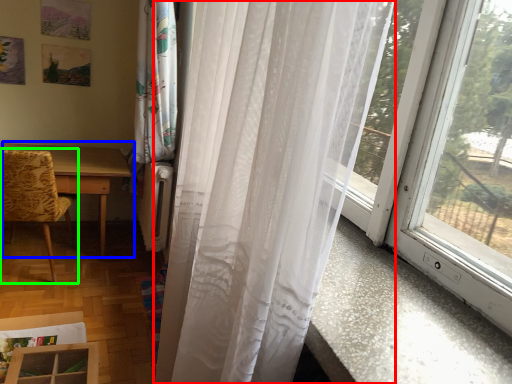
Question: Considering the real-world distances, which object is closest to curtain (highlighted by a red box)? table (highlighted by a blue box) or chair (highlighted by a green box).

Choices:
 (A) table
 (B) chair

Answer: (B)